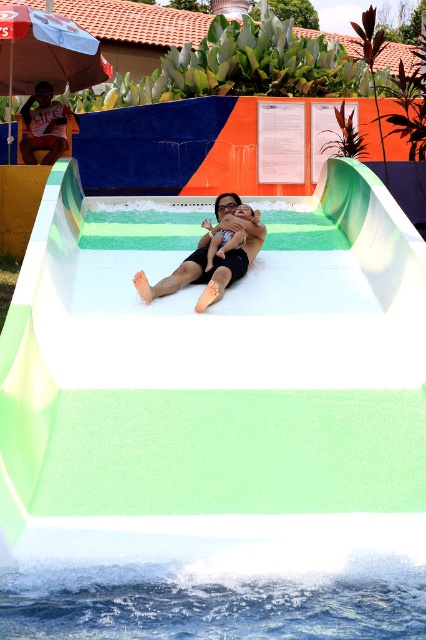
You are a visitor at the water park and want to put on your transparent plastic goggles at center before sliding down the white smooth water slide at center. Can you do this while staying on the slide?

The white smooth water slide at center is located below transparent plastic goggles at center, so you can reach the transparent plastic goggles at center first before sliding down the white smooth water slide at center.

You are a photographer trying to capture the man and child sliding down the water slide. You notice the black smooth skin at center and the transparent plastic goggles at center in your shot. Which object should you adjust your focus to ensure the subject is clear?

The black smooth skin at center is in front of transparent plastic goggles at center, so focusing on the black smooth skin at center will ensure the subject is clear.